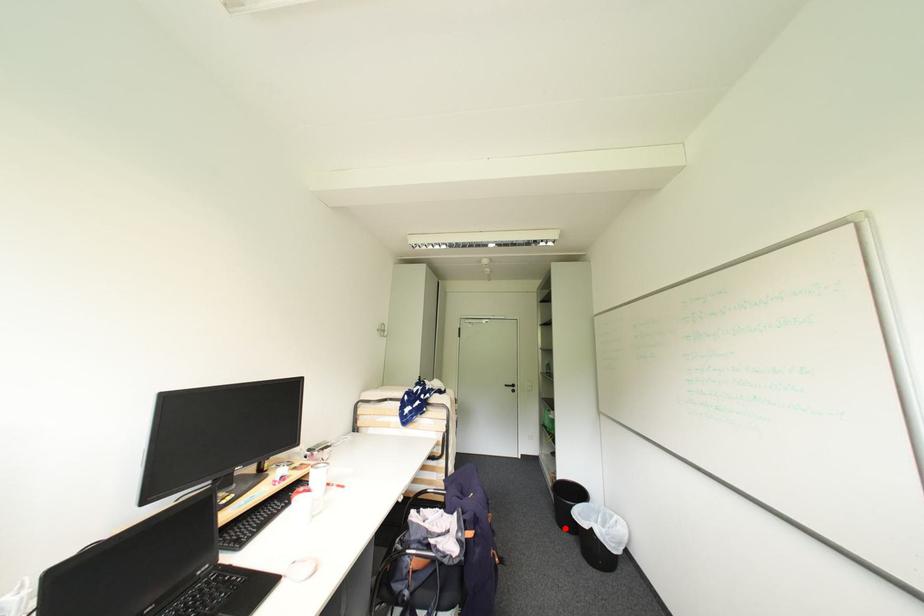
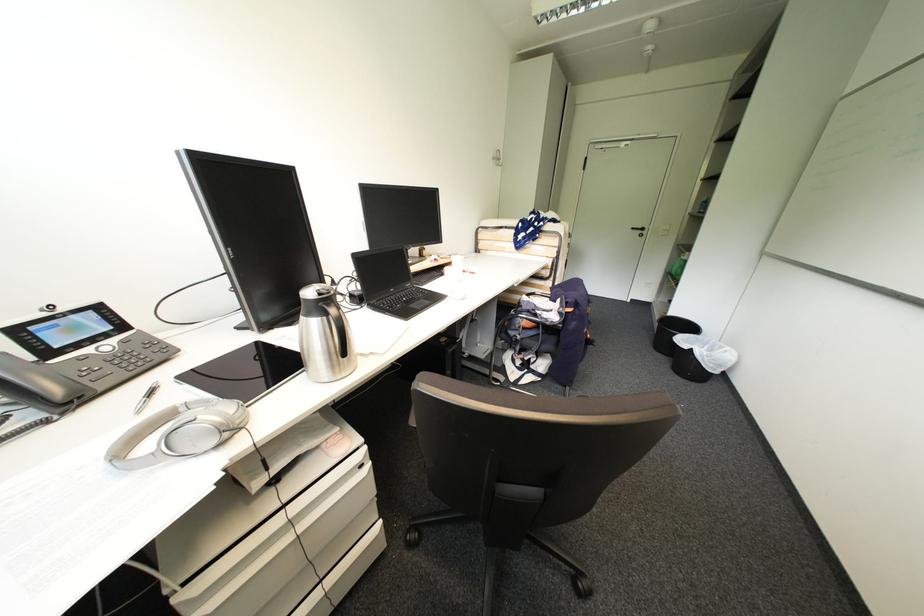
Question: I am providing you with two images of the same scene from different viewpoints. A red point is marked on the first image. At the location where the point appears in image 1, is it still visible in image 2?

Choices:
 (A) Yes
 (B) No

Answer: (A)